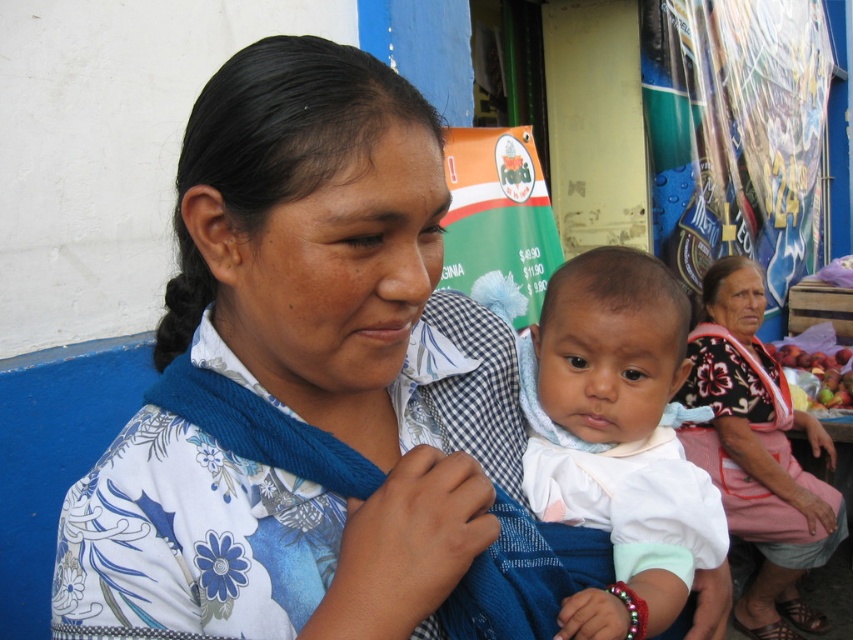
Is blue floral shirt at center closer to the viewer compared to floral fabric dress at lower right?

That is True.

Based on the photo, is blue floral shirt at center shorter than floral fabric dress at lower right?

Indeed, blue floral shirt at center has a lesser height compared to floral fabric dress at lower right.

Find the location of `blue floral shirt at center`. blue floral shirt at center is located at coordinates (289, 374).

At what (x,y) coordinates should I click in order to perform the action: click on blue floral shirt at center. Please return your answer as a coordinate pair (x, y). Looking at the image, I should click on (289, 374).

Is point (566, 406) less distant than point (705, 384)?

That is True.

Is point (589, 269) positioned before point (746, 458)?

Yes, point (589, 269) is in front of point (746, 458).

The image size is (853, 640). Identify the location of white soft cloth at center. (621, 438).

From the picture: Does blue floral shirt at center have a lesser width compared to white soft cloth at center?

No, blue floral shirt at center is not thinner than white soft cloth at center.

The height and width of the screenshot is (640, 853). In order to click on blue floral shirt at center in this screenshot , I will do `click(289, 374)`.